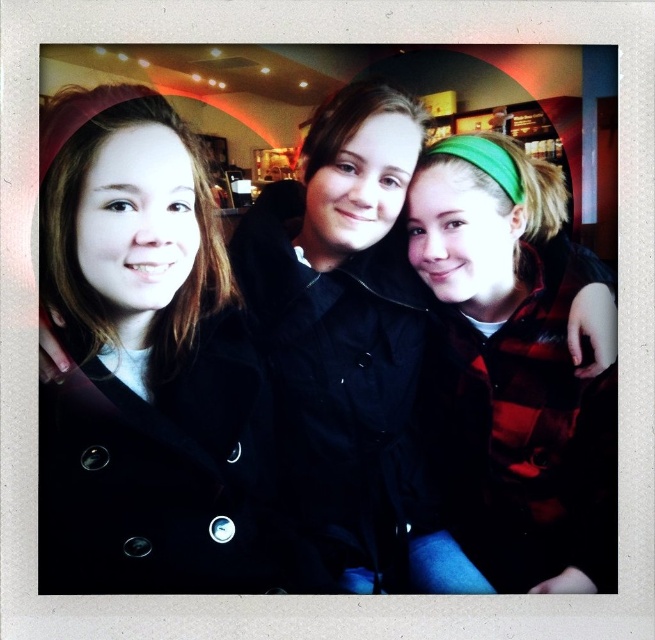
Is matte black coat at left shorter than green plaid shirt at center?

Correct, matte black coat at left is not as tall as green plaid shirt at center.

How far apart are matte black coat at left and green plaid shirt at center?

matte black coat at left is 17.30 inches from green plaid shirt at center.

Find the location of a particular element. The height and width of the screenshot is (640, 655). matte black coat at left is located at coordinates (143, 364).